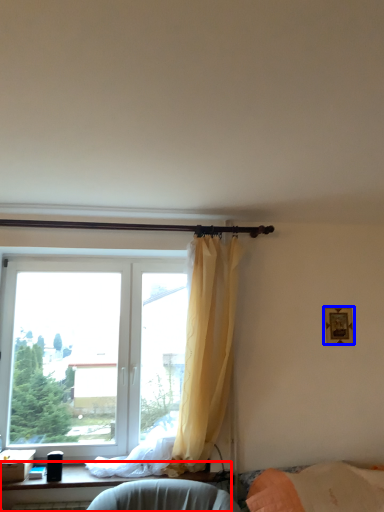
Question: Among these objects, which one is farthest to the camera, furniture (highlighted by a red box) or picture frame (highlighted by a blue box)?

Choices:
 (A) furniture
 (B) picture frame

Answer: (B)